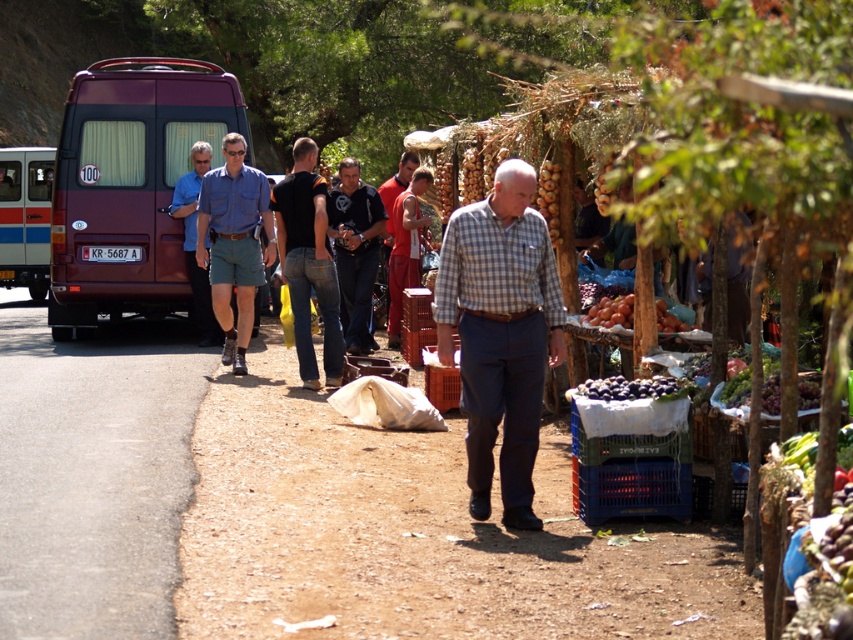
Which is more to the right, black denim jeans at center or red cotton t-shirt at center?

red cotton t-shirt at center

You are a GUI agent. You are given a task and a screenshot of the screen. Output one action in this format:
    pyautogui.click(x=<x>, y=<y>)
    Task: Click on the black denim jeans at center
    The image size is (853, 640).
    Given the screenshot: What is the action you would take?
    pyautogui.click(x=308, y=262)

Does checkered fabric shirt at center have a larger size compared to matte red van at left?

Incorrect, checkered fabric shirt at center is not larger than matte red van at left.

Is checkered fabric shirt at center above matte red van at left?

No, checkered fabric shirt at center is not above matte red van at left.

Looking at this image, who is more distant from viewer, (x=512, y=200) or (x=19, y=156)?

Positioned behind is point (x=19, y=156).

Find the location of a particular element. checkered fabric shirt at center is located at coordinates (500, 333).

Who is more distant from viewer, (117,112) or (631,310)?

Positioned behind is point (117,112).

Is maroon matte van at left above shiny purple grapes at center?

Yes.

The height and width of the screenshot is (640, 853). Identify the location of maroon matte van at left. (129, 184).

The image size is (853, 640). I want to click on maroon matte van at left, so click(x=129, y=184).